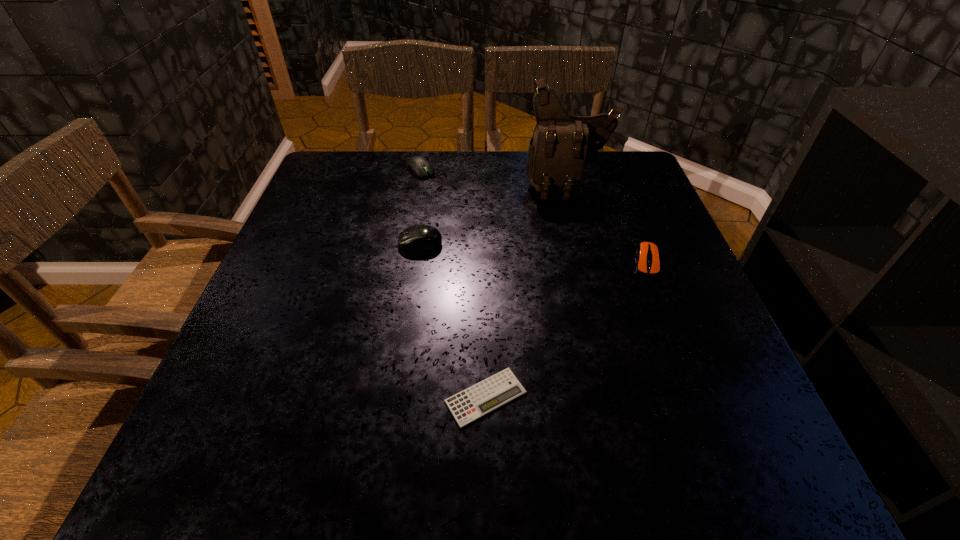
You are a GUI agent. You are given a task and a screenshot of the screen. Output one action in this format:
    pyautogui.click(x=<x>, y=<y>)
    Task: Click on the tallest object
    
    Given the screenshot: What is the action you would take?
    pyautogui.click(x=561, y=144)

This screenshot has width=960, height=540. Identify the location of the second tallest object. (426, 238).

Find the location of `the second shortest computer mouse`. the second shortest computer mouse is located at coordinates (419, 166).

I want to click on the third shortest object, so click(x=419, y=166).

Locate an element on the screen. the fourth tallest object is located at coordinates (647, 254).

The image size is (960, 540). In order to click on the rightmost computer mouse in this screenshot , I will do `click(647, 254)`.

You are a GUI agent. You are given a task and a screenshot of the screen. Output one action in this format:
    pyautogui.click(x=<x>, y=<y>)
    Task: Click on the calculator
    
    Given the screenshot: What is the action you would take?
    pyautogui.click(x=490, y=394)

Find the location of a particular element. Image resolution: width=960 pixels, height=540 pixels. the shortest object is located at coordinates (490, 394).

Find the location of a particular element. The image size is (960, 540). free space located on the front-facing side of the shoulder bag is located at coordinates (600, 314).

Locate an element on the screen. vacant space located 0.310m on the right of the second tallest object is located at coordinates (578, 244).